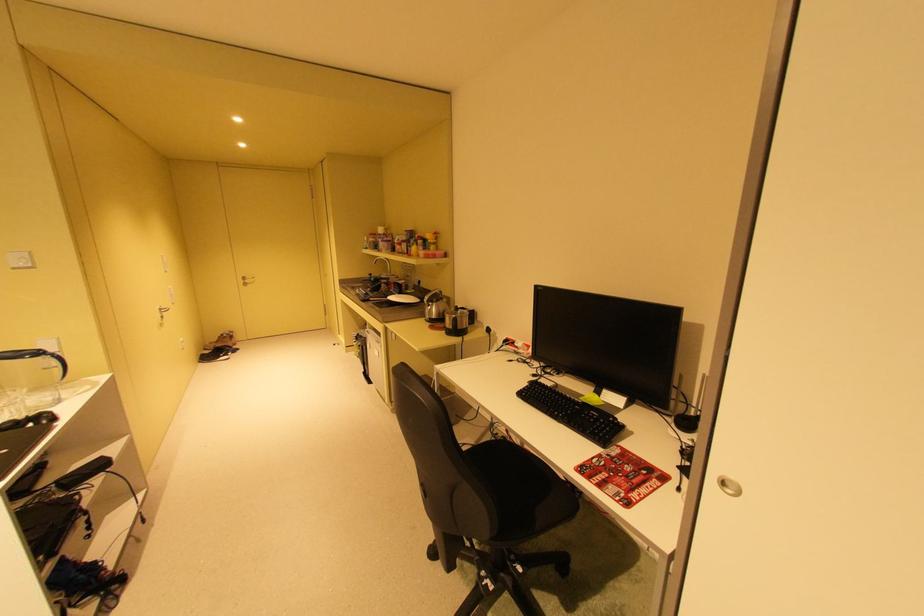
The height and width of the screenshot is (616, 924). I want to click on black pitcher handle, so click(x=456, y=325).